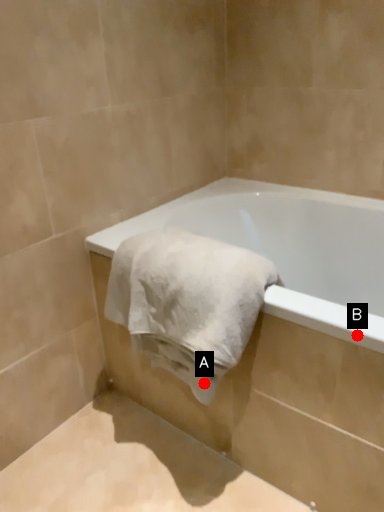
Question: Two points are circled on the image, labeled by A and B beside each circle. Which point is closer to the camera taking this photo?

Choices:
 (A) A is closer
 (B) B is closer

Answer: (B)